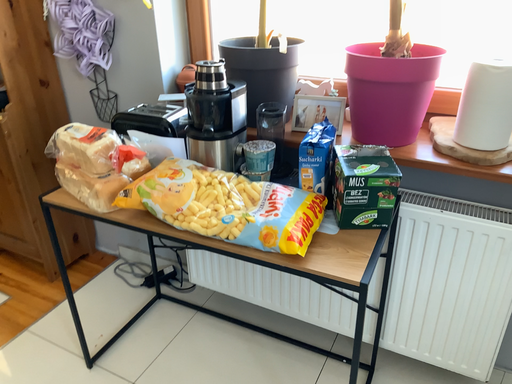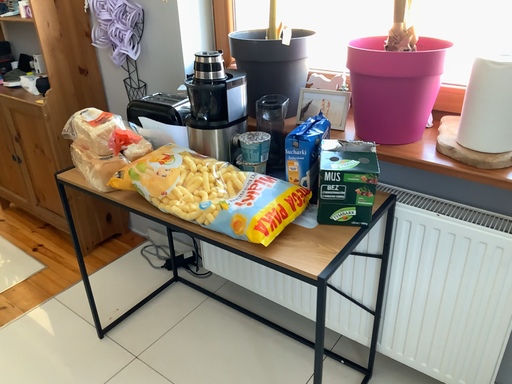
Question: Which way did the camera rotate in the video?

Choices:
 (A) rotated right
 (B) rotated left

Answer: (B)